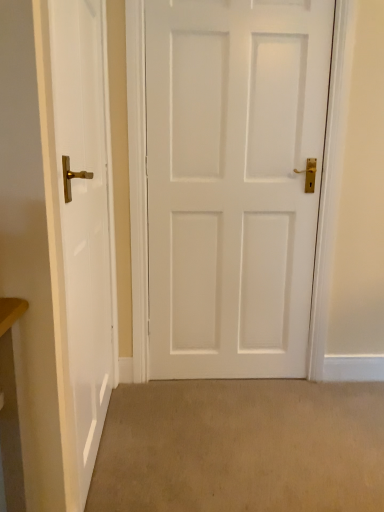
Question: Is the position of beige carpet at lower center more distant than that of white matte door at center, placed as the 1th door when sorted from right to left?

Choices:
 (A) no
 (B) yes

Answer: (A)

Question: From a real-world perspective, is beige carpet at lower center over white matte door at center, the second door positioned from the left?

Choices:
 (A) no
 (B) yes

Answer: (A)

Question: From the image's perspective, is beige carpet at lower center on top of white matte door at center, placed as the 1th door when sorted from right to left?

Choices:
 (A) no
 (B) yes

Answer: (A)

Question: Would you say beige carpet at lower center contains white matte door at center, placed as the 1th door when sorted from right to left?

Choices:
 (A) yes
 (B) no

Answer: (B)

Question: Is beige carpet at lower center oriented away from white matte door at center, placed as the 1th door when sorted from right to left?

Choices:
 (A) no
 (B) yes

Answer: (A)

Question: In the image, is beige carpet at lower center positioned in front of or behind white glossy door at left, the 2th door from the right?

Choices:
 (A) behind
 (B) front

Answer: (A)

Question: Is beige carpet at lower center taller or shorter than white glossy door at left, the 2th door from the right?

Choices:
 (A) tall
 (B) short

Answer: (B)

Question: In the image, is beige carpet at lower center on the left side or the right side of white glossy door at left, the 2th door from the right?

Choices:
 (A) left
 (B) right

Answer: (B)

Question: Considering the positions of beige carpet at lower center and white glossy door at left, the 2th door from the right, in the image, is beige carpet at lower center wider or thinner than white glossy door at left, the 2th door from the right,?

Choices:
 (A) thin
 (B) wide

Answer: (B)

Question: Considering the positions of white matte door at center, placed as the 1th door when sorted from right to left, and white glossy door at left, which appears as the 1th door when viewed from the left, in the image, is white matte door at center, placed as the 1th door when sorted from right to left, bigger or smaller than white glossy door at left, which appears as the 1th door when viewed from the left,?

Choices:
 (A) small
 (B) big

Answer: (B)

Question: Considering the positions of point (216, 229) and point (66, 302), is point (216, 229) closer or farther from the camera than point (66, 302)?

Choices:
 (A) closer
 (B) farther

Answer: (B)

Question: Visually, is white matte door at center, the second door positioned from the left, positioned to the left or to the right of white glossy door at left, the 2th door from the right?

Choices:
 (A) left
 (B) right

Answer: (B)

Question: Is white matte door at center, the second door positioned from the left, inside the boundaries of white glossy door at left, the 2th door from the right, or outside?

Choices:
 (A) outside
 (B) inside

Answer: (A)

Question: From the image's perspective, is white matte door at center, placed as the 1th door when sorted from right to left, above or below beige carpet at lower center?

Choices:
 (A) above
 (B) below

Answer: (A)

Question: Is white matte door at center, the second door positioned from the left, bigger or smaller than beige carpet at lower center?

Choices:
 (A) big
 (B) small

Answer: (A)